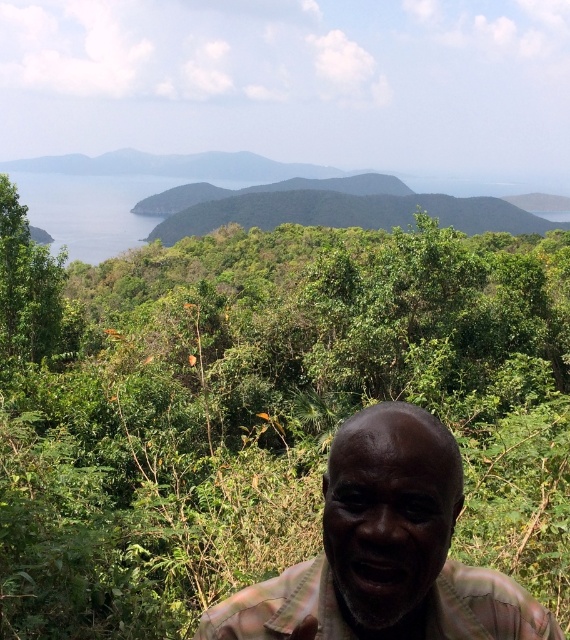
You are standing in a scenic outdoor area with lush greenery and rolling hills. You see a green leafy jungle at center and a plaid fabric face at center. Which object is closer to you?

The plaid fabric face at center is closer to you since the green leafy jungle at center is 28.48 meters away from it.

You are an explorer navigating through the jungle. You see the green leafy jungle at center and the plaid fabric face at center. Which object is closer to you?

The green leafy jungle at center is closer to you because the plaid fabric face at center is behind it.